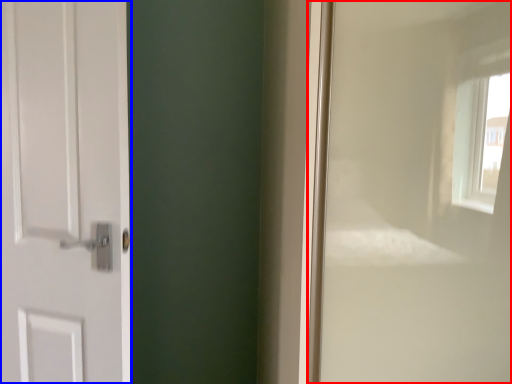
Question: Which point is closer to the camera, window frame (highlighted by a red box) or door (highlighted by a blue box)?

Choices:
 (A) window frame
 (B) door

Answer: (A)